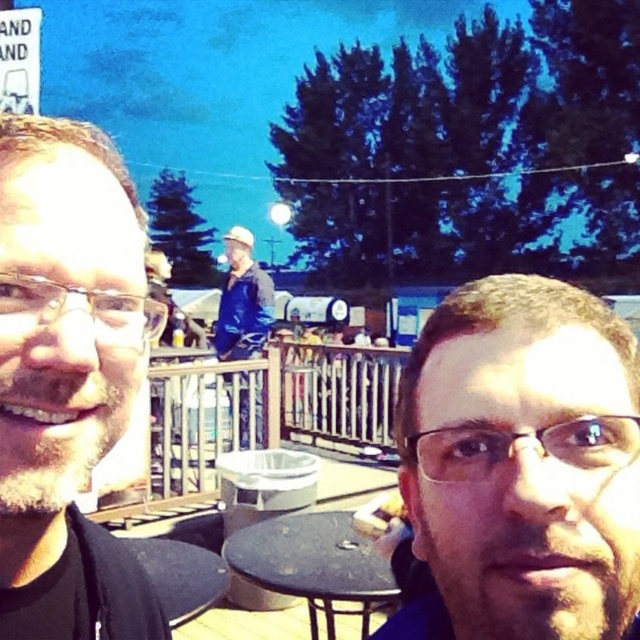
Does matte black glasses at center have a larger size compared to black matte face at left?

Actually, matte black glasses at center might be smaller than black matte face at left.

Between point (600, 525) and point (10, 563), which one is positioned behind?

Positioned behind is point (10, 563).

This screenshot has width=640, height=640. What do you see at coordinates (522, 465) in the screenshot? I see `matte black glasses at center` at bounding box center [522, 465].

What are the coordinates of `matte black glasses at center` in the screenshot? It's located at (522, 465).

Which is more to the left, black glass table at lower center or blue denim jacket at center?

Positioned to the left is blue denim jacket at center.

Image resolution: width=640 pixels, height=640 pixels. What do you see at coordinates (314, 564) in the screenshot? I see `black glass table at lower center` at bounding box center [314, 564].

Is point (330, 545) positioned before point (244, 397)?

Yes, point (330, 545) is closer to viewer.

The height and width of the screenshot is (640, 640). I want to click on black glass table at lower center, so click(x=314, y=564).

Which is behind, point (449, 333) or point (241, 333)?

The point (241, 333) is more distant.

Can you confirm if matte black glasses at center is positioned to the right of blue denim jacket at center?

Yes, matte black glasses at center is to the right of blue denim jacket at center.

Is point (547, 458) closer to camera compared to point (241, 305)?

Yes, it is.

The height and width of the screenshot is (640, 640). I want to click on matte black glasses at center, so pos(522,465).